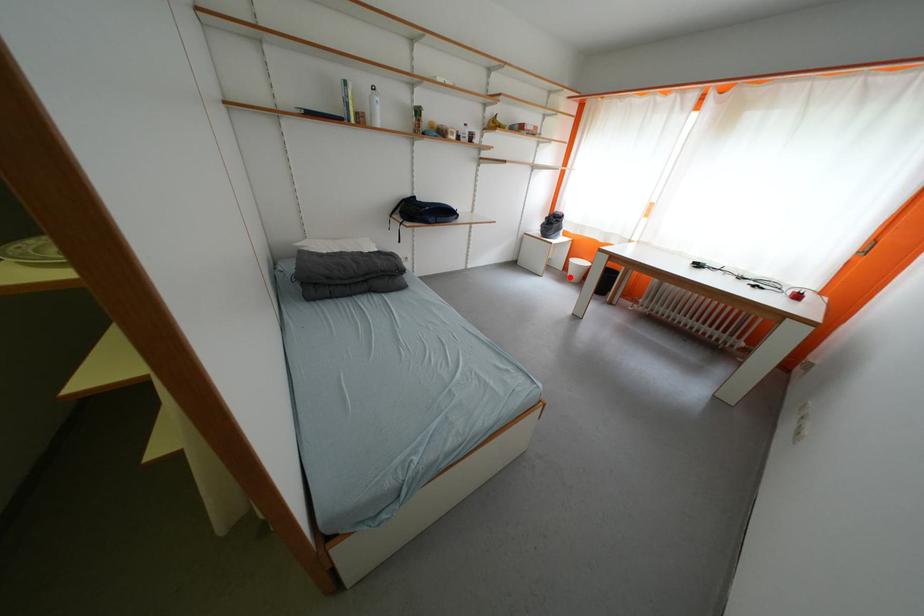
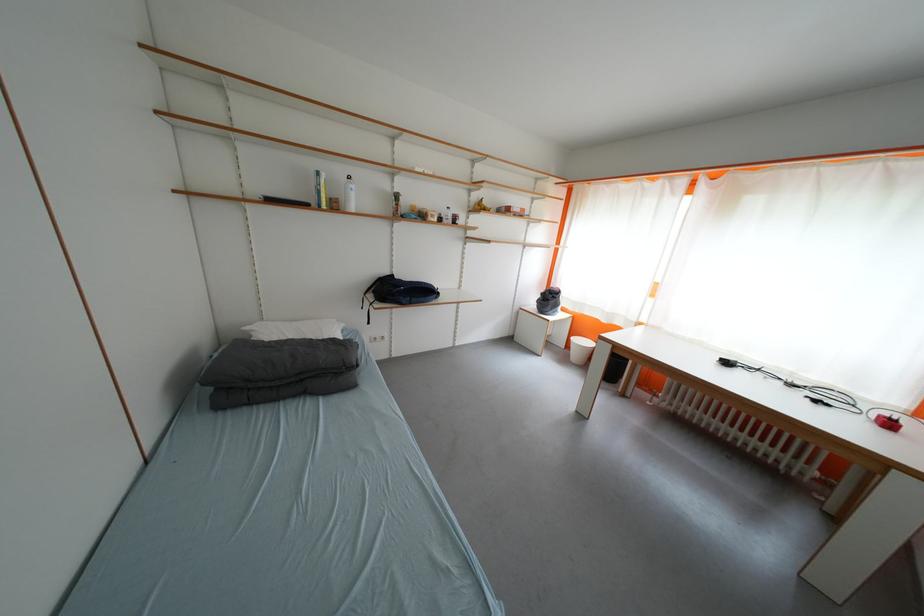
Where in the second image is the point corresponding to the highlighted location from the first image?

(572, 358)